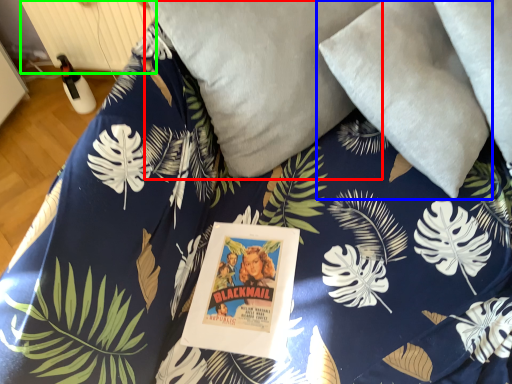
Question: Which object is positioned farthest from pillow (highlighted by a red box)? Select from pillow (highlighted by a blue box) and radiator (highlighted by a green box).

Choices:
 (A) pillow
 (B) radiator

Answer: (B)